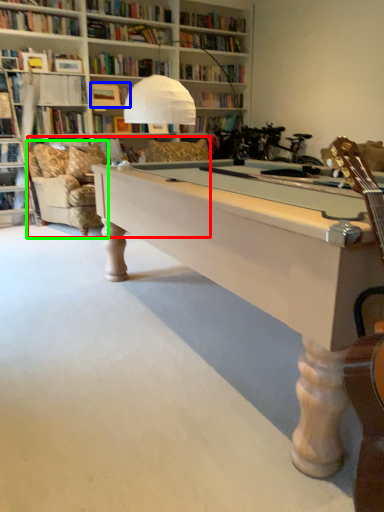
Question: Which object is positioned closest to couch (highlighted by a red box)? Select from book (highlighted by a blue box) and swivel chair (highlighted by a green box).

Choices:
 (A) book
 (B) swivel chair

Answer: (B)